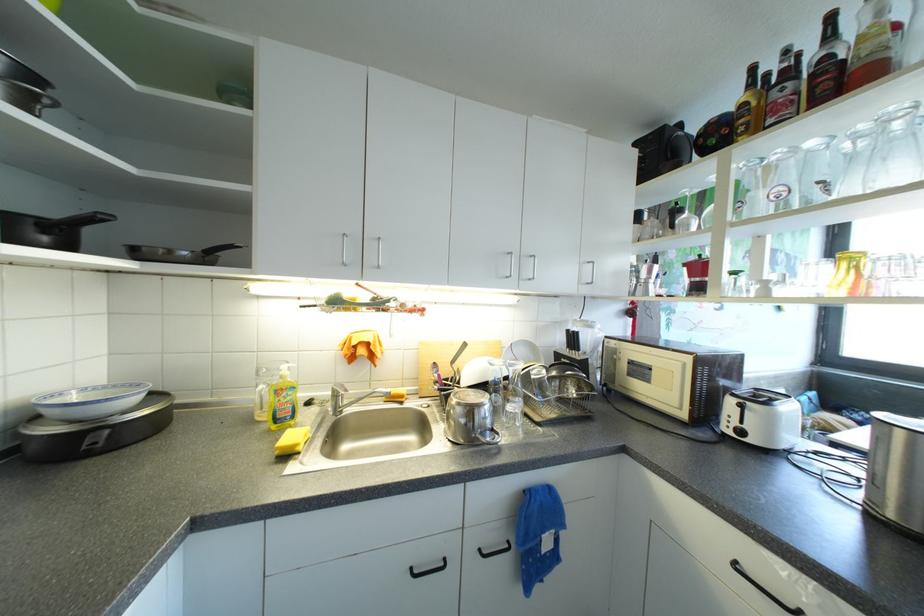
Describe the element at coordinates (288, 368) in the screenshot. I see `the soap pump` at that location.